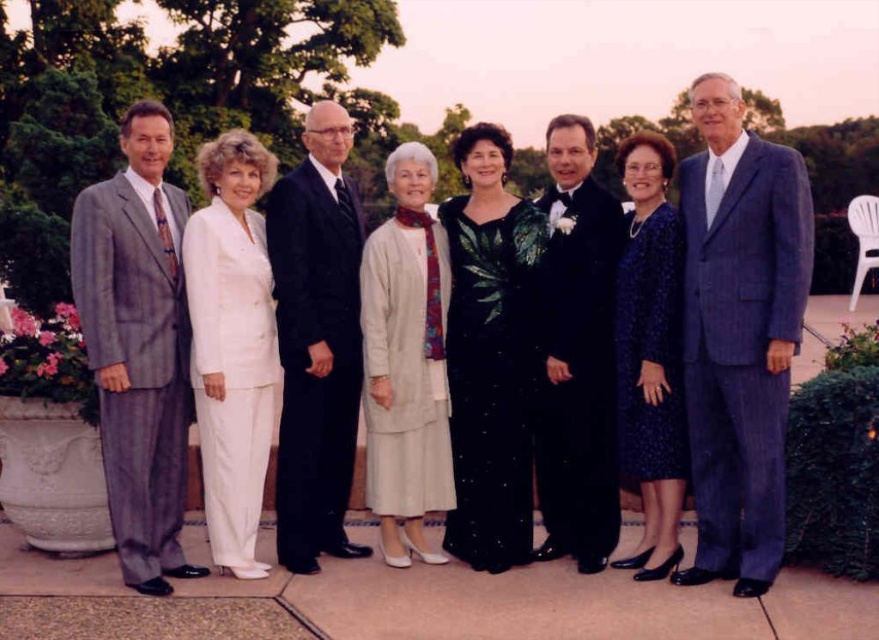
You are a photographer who needs to adjust the lighting between the white satin suit at center and the velvet black tuxedo at center. How far apart are these two outfits?

The white satin suit at center and the velvet black tuxedo at center are 1.68 meters apart from each other.

You are a photographer arranging a group photo. You have two men in suits in the frame. The matte gray suit at left and the blue pinstripe suit at right. Which man in the suit is positioned more to the left side of the frame?

The matte gray suit at left is positioned more to the left side of the frame than the blue pinstripe suit at right.